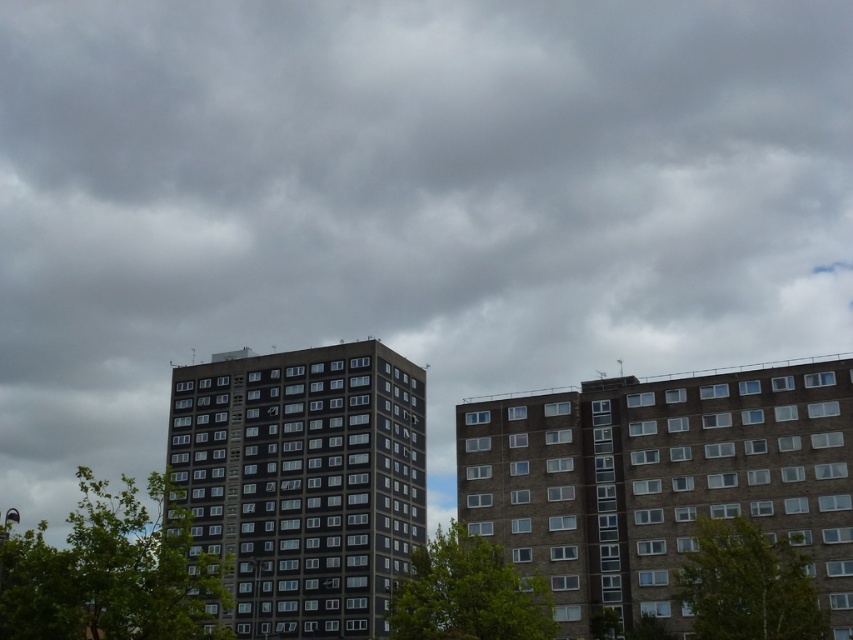
Based on the photo, you are a city planner assessing the urban space between the dark gray concrete building at center and the green leafy tree at center. Based on their widths, which one occupies more horizontal space in the image?

The dark gray concrete building at center might be wider than green leafy tree at center, so it likely occupies more horizontal space in the image.

You are a landscape architect planning to install a new bench between the green leafy tree at lower left and the green leafy tree at lower center. Based on their widths, which tree should the bench be placed closer to for better spacing?

The green leafy tree at lower left might be wider than the green leafy tree at lower center, so the bench should be placed closer to the narrower tree at lower center to ensure adequate space around both trees.

You are a drone operator trying to capture a photo of the green leafy tree at center. Your drone is currently at point A located at coordinates (747,584). Can you confirm if this point is the correct location for the green leafy tree at center?

Yes, the point at coordinates (747,584) is the correct location for the green leafy tree at center as indicated by the description.